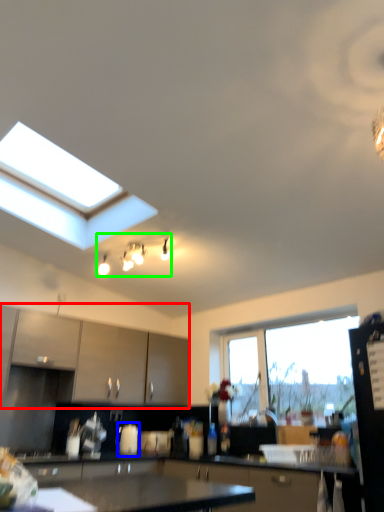
Question: Based on their relative distances, which object is farther from cabinetry (highlighted by a red box)? Choose from appliance (highlighted by a blue box) and light fixture (highlighted by a green box).

Choices:
 (A) appliance
 (B) light fixture

Answer: (B)